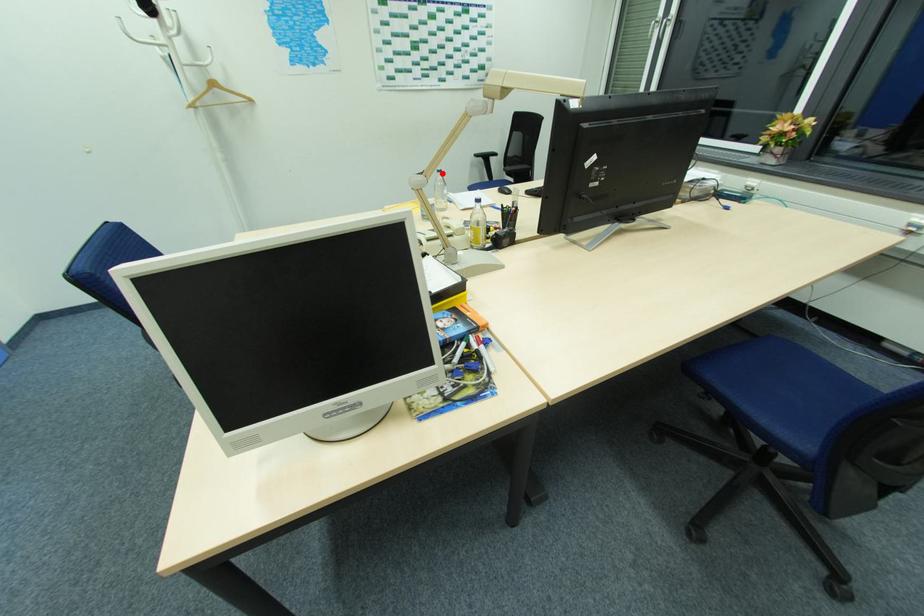
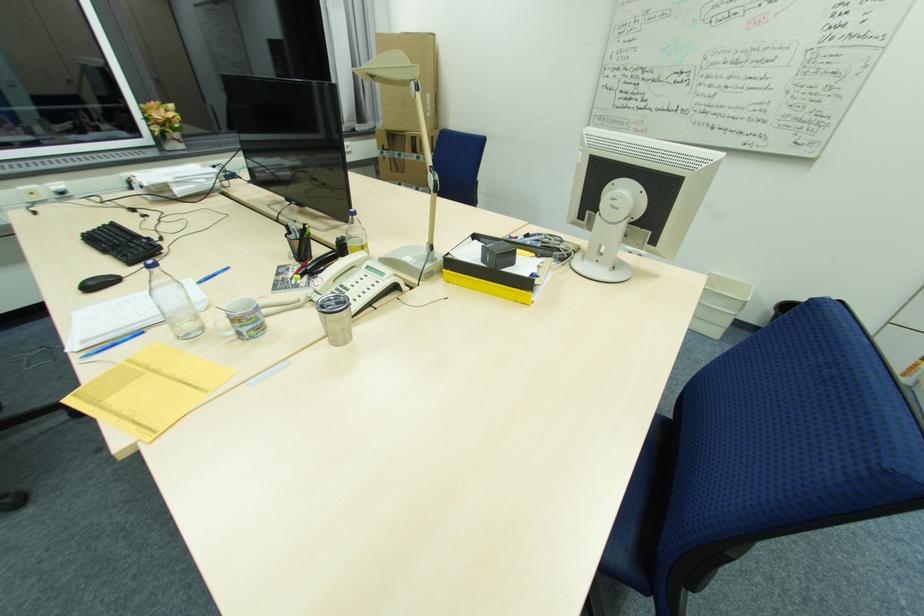
The point at the highlighted location is marked in the first image. Where is the corresponding point in the second image?

(157, 270)